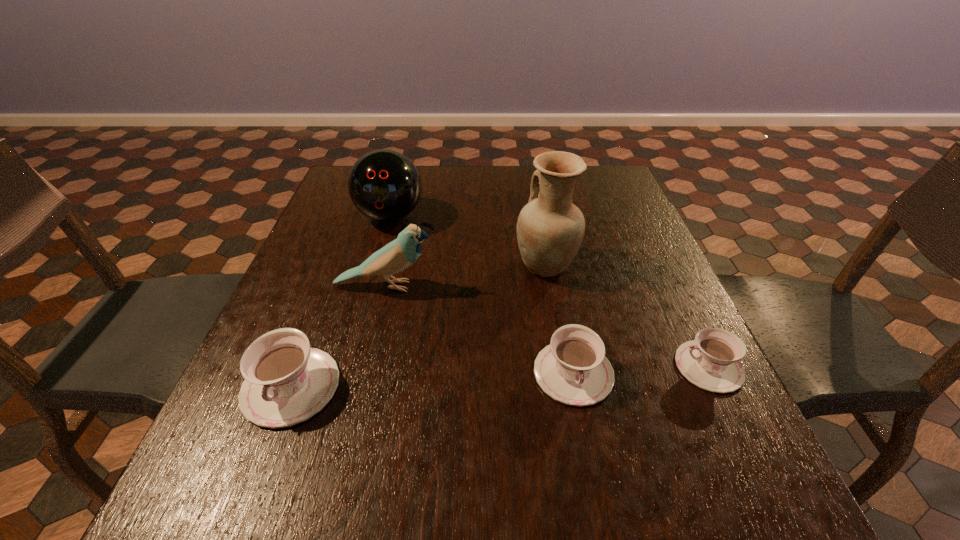
Locate an element on the screen. This screenshot has width=960, height=540. vacant space located on the handle side of the shortest object is located at coordinates (603, 367).

Image resolution: width=960 pixels, height=540 pixels. Find the location of `free spot located on the front of the tallest object`. free spot located on the front of the tallest object is located at coordinates (555, 319).

Locate an element on the screen. vacant space located 0.190m on the surface of the bowling ball near the finger holes is located at coordinates (372, 285).

This screenshot has width=960, height=540. What are the coordinates of `blank area located at the face of the bird` in the screenshot? It's located at (608, 286).

This screenshot has height=540, width=960. I want to click on object at the far edge, so point(384,185).

The width and height of the screenshot is (960, 540). In order to click on teacup that is at the left edge in this screenshot , I will do `click(286, 382)`.

The image size is (960, 540). In order to click on bowling ball situated at the left edge in this screenshot , I will do `click(384, 185)`.

Locate an element on the screen. The height and width of the screenshot is (540, 960). bird at the left edge is located at coordinates (396, 256).

Locate an element on the screen. This screenshot has height=540, width=960. object that is at the right edge is located at coordinates (711, 361).

The image size is (960, 540). I want to click on object positioned at the far left corner, so click(384, 185).